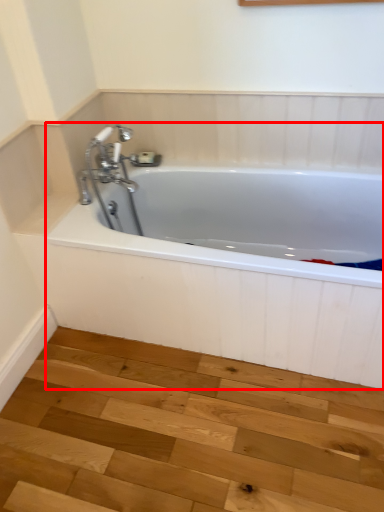
Question: From the image's perspective, where is bathtub (annotated by the red box) located relative to stair?

Choices:
 (A) below
 (B) above

Answer: (B)